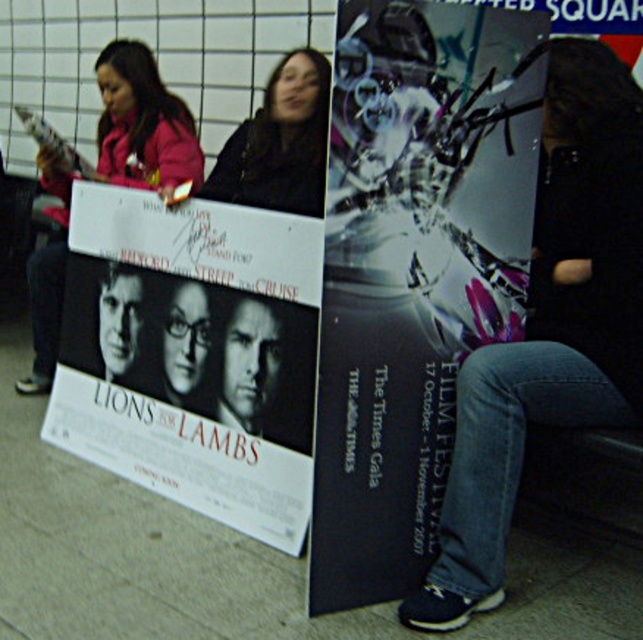
Question: Which point appears closest to the camera in this image?

Choices:
 (A) (543, 241)
 (B) (163, 125)
 (C) (129, 460)

Answer: (A)

Question: Among these points, which one is nearest to the camera?

Choices:
 (A) (592, 348)
 (B) (422, 108)
 (C) (293, 60)
 (D) (203, 157)

Answer: (B)

Question: Can you confirm if matte pink jacket at upper left is thinner than black fabric jacket at center?

Choices:
 (A) yes
 (B) no

Answer: (B)

Question: Which of the following is the closest to the observer?

Choices:
 (A) matte pink jacket at upper left
 (B) metallic silver poster at center
 (C) white paper poster at center

Answer: (B)

Question: Is white paper poster at center bigger than black fabric jacket at center?

Choices:
 (A) no
 (B) yes

Answer: (B)

Question: Is white paper poster at center positioned before matte pink jacket at upper left?

Choices:
 (A) yes
 (B) no

Answer: (A)